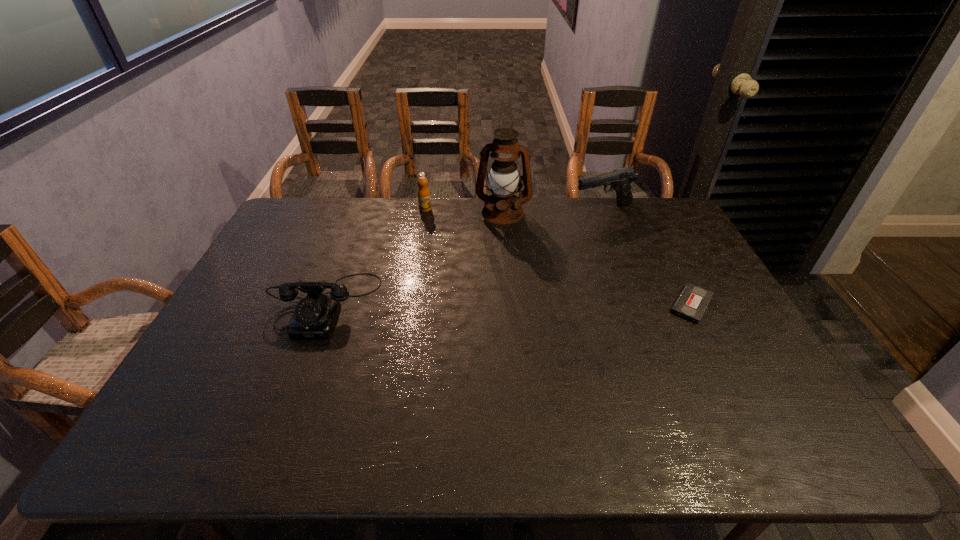
You are a GUI agent. You are given a task and a screenshot of the screen. Output one action in this format:
    pyautogui.click(x=<x>, y=<y>)
    Task: Click on the vacant space on the desktop that is between the second shortest object and the videotape and is positioned on the side of the lantern, there is a wick adjustment knob
    
    Given the screenshot: What is the action you would take?
    pyautogui.click(x=484, y=304)

Image resolution: width=960 pixels, height=540 pixels. Identify the location of vacant spot on the desktop that is between the telephone and the videotape and is positioned on the front label of the fourth object from right to left. (479, 304).

Where is `vacant space on the desktop that is between the telephone and the shortest object and is positioned at the muzzle of the gun`? Image resolution: width=960 pixels, height=540 pixels. vacant space on the desktop that is between the telephone and the shortest object and is positioned at the muzzle of the gun is located at coordinates (542, 304).